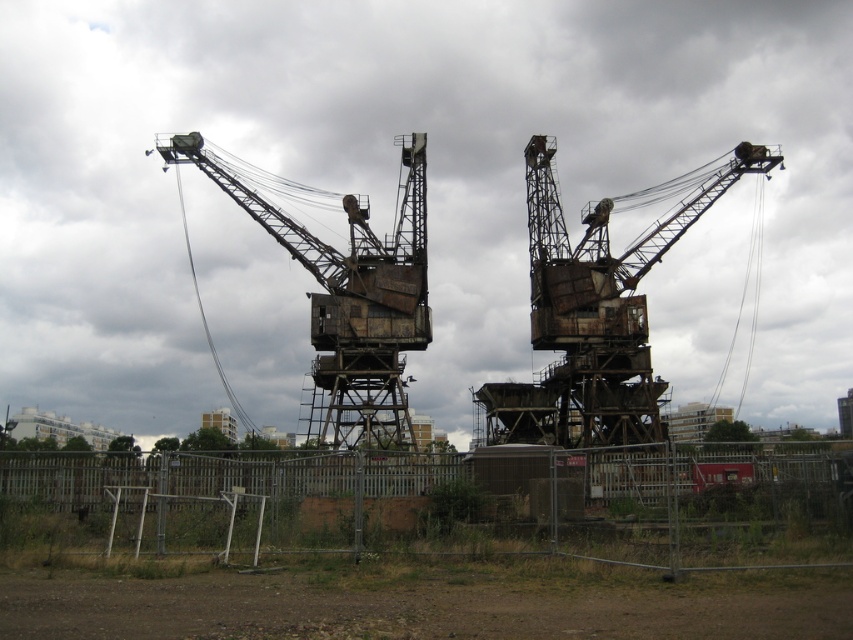
Question: Can you confirm if metal fence at lower center is thinner than rusty metal crane at center?

Choices:
 (A) no
 (B) yes

Answer: (A)

Question: Which point is farther from the camera taking this photo?

Choices:
 (A) (242, 209)
 (B) (286, 524)

Answer: (A)

Question: Which point is farther to the camera?

Choices:
 (A) rusty metal crane at center
 (B) metal fence at lower center

Answer: (A)

Question: Is metal fence at lower center closer to camera compared to rusty metal crane at center?

Choices:
 (A) no
 (B) yes

Answer: (B)

Question: Which point is farther from the camera taking this photo?

Choices:
 (A) (392, 305)
 (B) (173, 467)

Answer: (A)

Question: Can you confirm if metal fence at lower center is positioned below rusty metal crane at center?

Choices:
 (A) no
 (B) yes

Answer: (B)